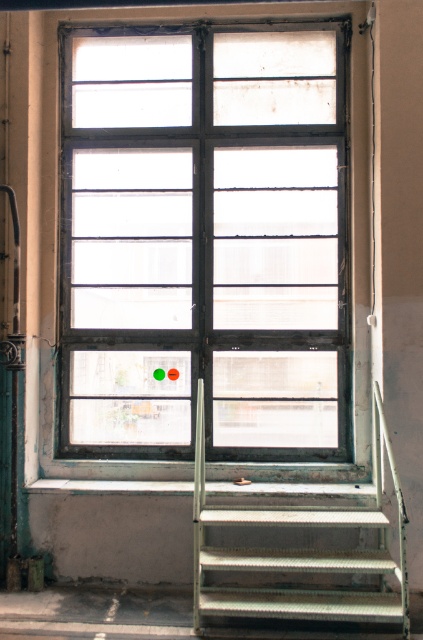
Question: Does matte glass window at center appear on the left side of metallic gray stairs at lower right?

Choices:
 (A) yes
 (B) no

Answer: (A)

Question: Which point appears closest to the camera in this image?

Choices:
 (A) [x=376, y=433]
 (B) [x=247, y=445]

Answer: (A)

Question: Is matte glass window at center bigger than metallic gray stairs at lower right?

Choices:
 (A) no
 (B) yes

Answer: (A)

Question: Which point is farther to the camera?

Choices:
 (A) (107, 445)
 (B) (370, 570)

Answer: (A)

Question: Can you confirm if matte glass window at center is bigger than metallic gray stairs at lower right?

Choices:
 (A) yes
 (B) no

Answer: (B)